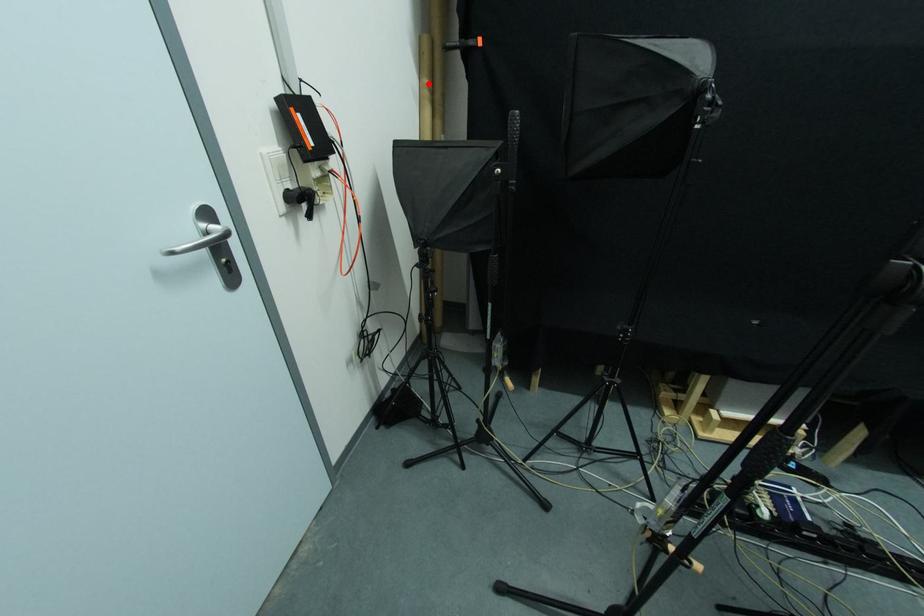
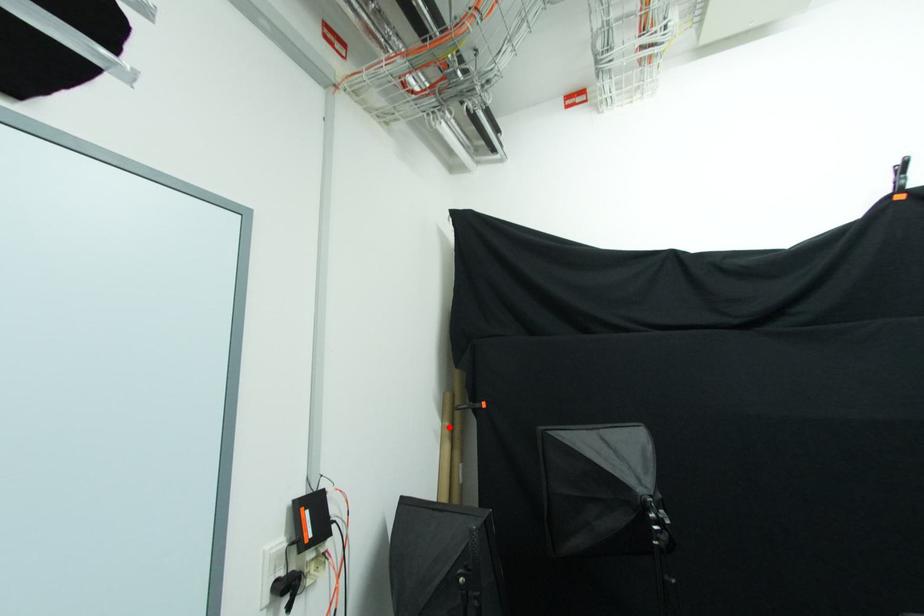
I am providing you with two images of the same scene from different viewpoints. A red point is marked on the first image and another point is marked on the second image. Are the points marked in image1 and image2 representing the same 3D position?

Yes